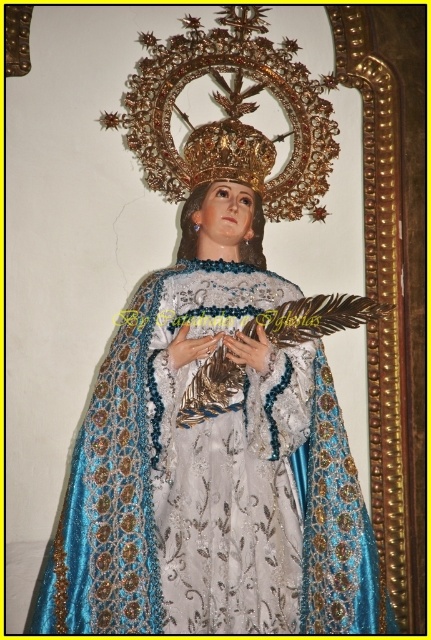
You are a photographer standing at the camera position. You want to capture a closeup shot of the silky blue fabric dress at center. Given that your camera has a minimum focusing distance of 10 feet, will you be able to take the photo without moving closer?

The silky blue fabric dress at center and camera are 211.31 feet apart, which is much farther than the camera minimum focusing distance of 10 feet. Therefore, you can take the photo without needing to move closer.